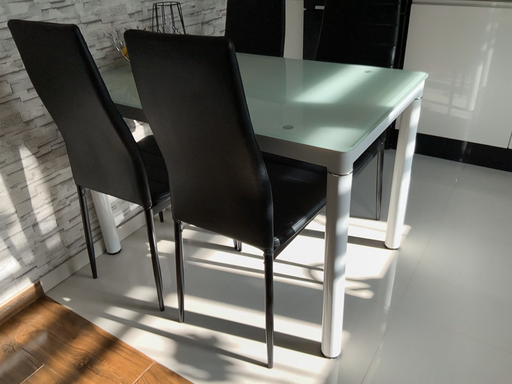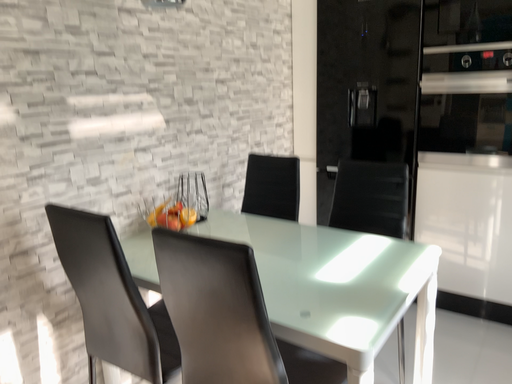
Question: Which way did the camera rotate in the video?

Choices:
 (A) rotated upward
 (B) rotated downward

Answer: (A)